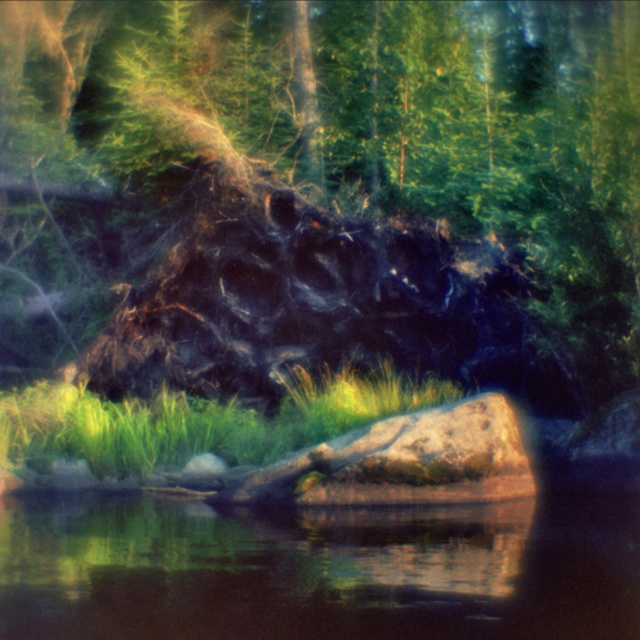
You are a hiker who wants to cross the water to reach the charcoal textured log at center. The log is 59.09 feet away from you. If your maximum jumping distance is 10 feet, how many jumps do you need to make?

The charcoal textured log at center is 59.09 feet away. Since your maximum jump is 10 feet, you would need at least 6 jumps to reach it.

You are standing in the forest and see the charcoal textured log at center and the green grass at lower center. Which object is closer to you?

The green grass at lower center is closer to you because it is positioned under the charcoal textured log at center, which is above it.